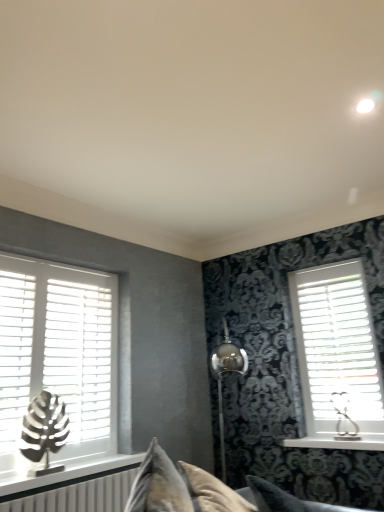
Question: From the image's perspective, is metallic silver table lamp at right, which ranks as the first table lamp in right-to-left order, positioned above or below white wood blinds at left, which appears as the 1th window when viewed from the left?

Choices:
 (A) above
 (B) below

Answer: (B)

Question: From a real-world perspective, is metallic silver table lamp at right, which is the 1th table lamp from back to front, above or below white wood blinds at left, which appears as the 2th window when viewed from the right?

Choices:
 (A) below
 (B) above

Answer: (A)

Question: Which object is the closest to the velvet beige couch at center?

Choices:
 (A) white plastic blinds at right, which is the 1th window in right-to-left order
 (B) white matte shutter at left
 (C) metallic leaf sculpture at left, positioned as the first table lamp in left-to-right order
 (D) white matte blinds at left
 (E) white wood blinds at left, which appears as the 1th window when viewed from the left

Answer: (C)

Question: Considering the real-world distances, which object is farthest from the white plastic blinds at right, which is the 1th window in right-to-left order?

Choices:
 (A) velvet gray pillow at lower center
 (B) white wood blinds at left, which appears as the 2th window when viewed from the right
 (C) metallic leaf sculpture at left, positioned as the first table lamp in left-to-right order
 (D) white wood window sill at right
 (E) white matte blinds at left

Answer: (C)